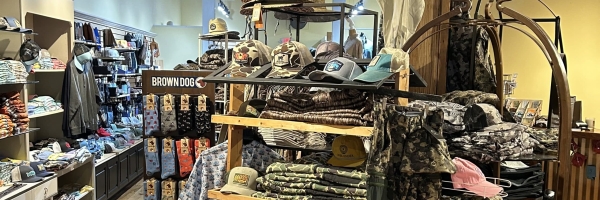
This screenshot has width=600, height=200. I want to click on place to ring up customers, so click(585, 130).